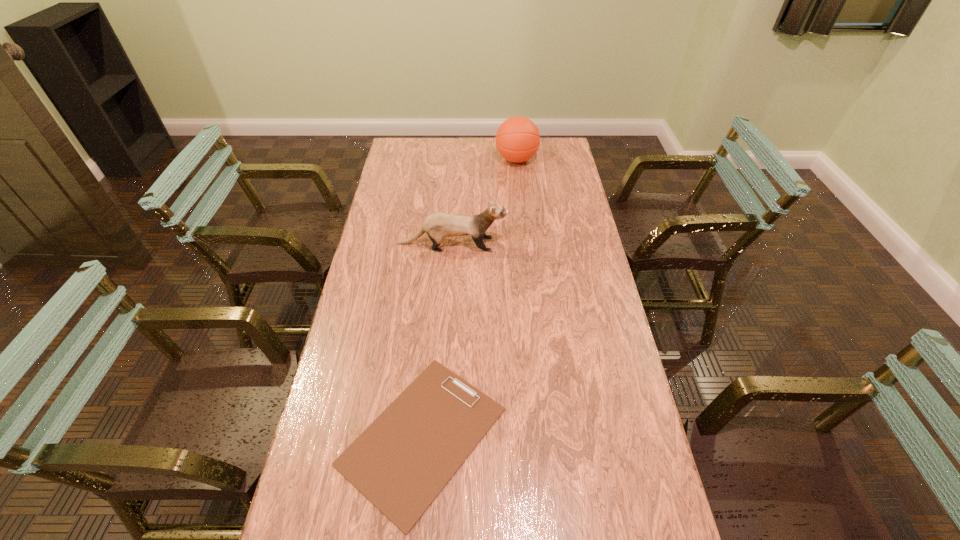
The height and width of the screenshot is (540, 960). Identify the location of vacant area between the second farthest object and the shortest object. (438, 340).

Image resolution: width=960 pixels, height=540 pixels. I want to click on free space between the shortest object and the second farthest object, so click(x=438, y=340).

Identify the location of blank region between the clipboard and the farthest object. (469, 298).

This screenshot has height=540, width=960. What are the coordinates of `free point between the second nearest object and the basketball` in the screenshot? It's located at (485, 202).

Locate an element on the screen. The width and height of the screenshot is (960, 540). vacant space that is in between the nearest object and the second farthest object is located at coordinates point(438,340).

Image resolution: width=960 pixels, height=540 pixels. Find the location of `object that is the second nearest to the second farthest object`. object that is the second nearest to the second farthest object is located at coordinates (401, 462).

Identify the location of object that is the second closest one to the ferret. Image resolution: width=960 pixels, height=540 pixels. (401, 462).

This screenshot has width=960, height=540. In order to click on free space that satisfies the following two spatial constraints: 1. on the face of the ferret; 2. on the front side of the shortest object in this screenshot , I will do `click(440, 436)`.

Where is `free space that satisfies the following two spatial constraints: 1. on the front side of the farthest object; 2. on the face of the ferret`? The width and height of the screenshot is (960, 540). free space that satisfies the following two spatial constraints: 1. on the front side of the farthest object; 2. on the face of the ferret is located at coordinates (525, 244).

Locate an element on the screen. This screenshot has height=540, width=960. free spot that satisfies the following two spatial constraints: 1. on the front side of the farthest object; 2. on the face of the ferret is located at coordinates (525, 244).